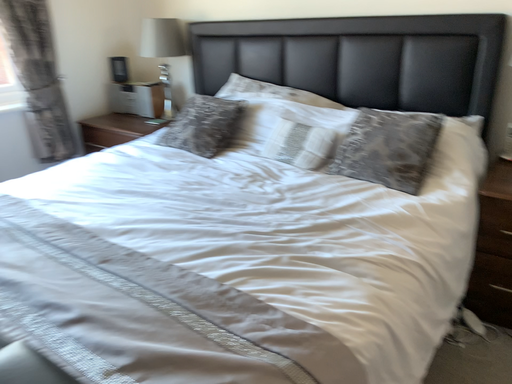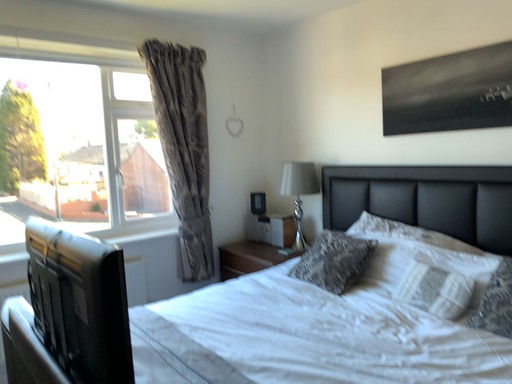
Question: How did the camera likely rotate when shooting the video?

Choices:
 (A) rotated left
 (B) rotated right

Answer: (A)